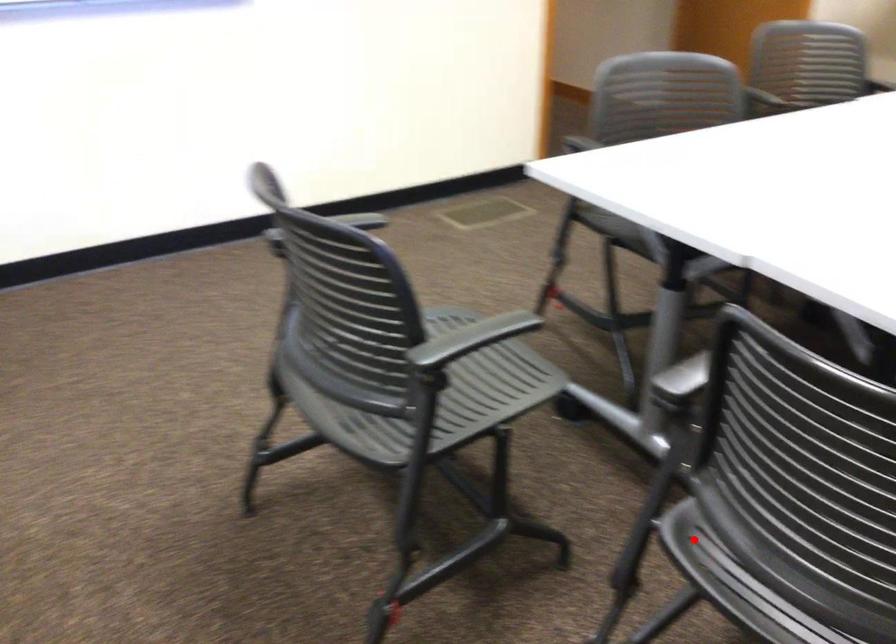
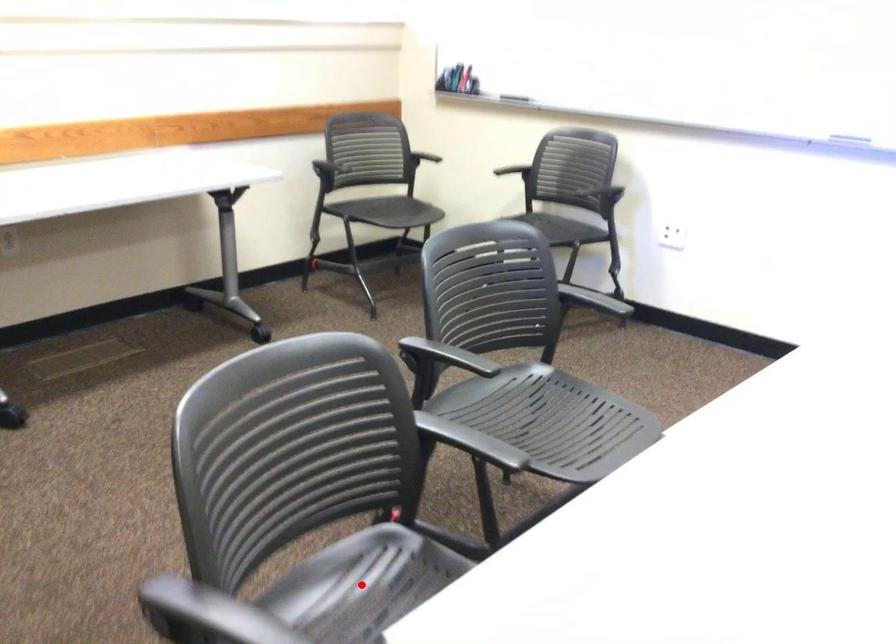
I am providing you with two images of the same scene from different viewpoints. A red point is marked on the first image and another point is marked on the second image. Is the marked point in image1 the same physical position as the marked point in image2?

Yes